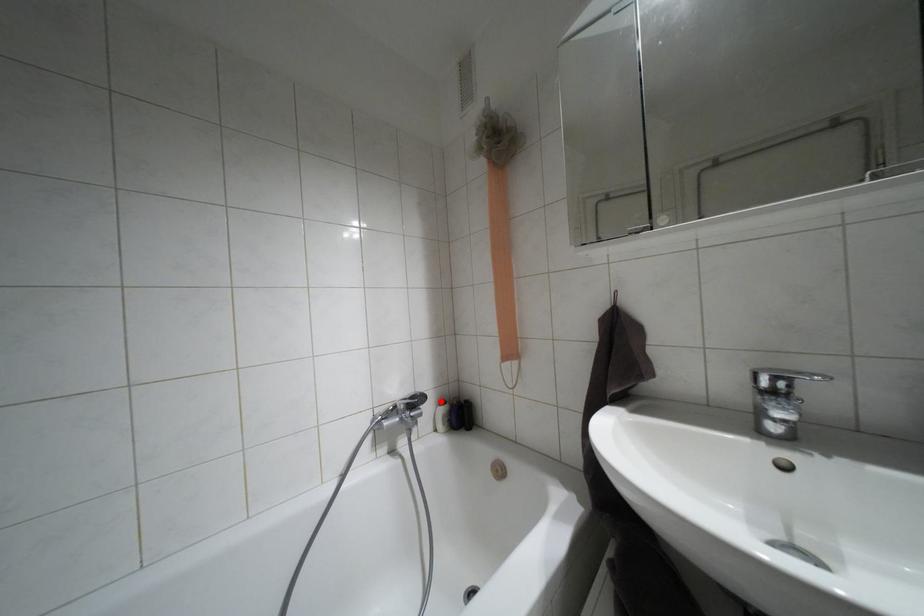
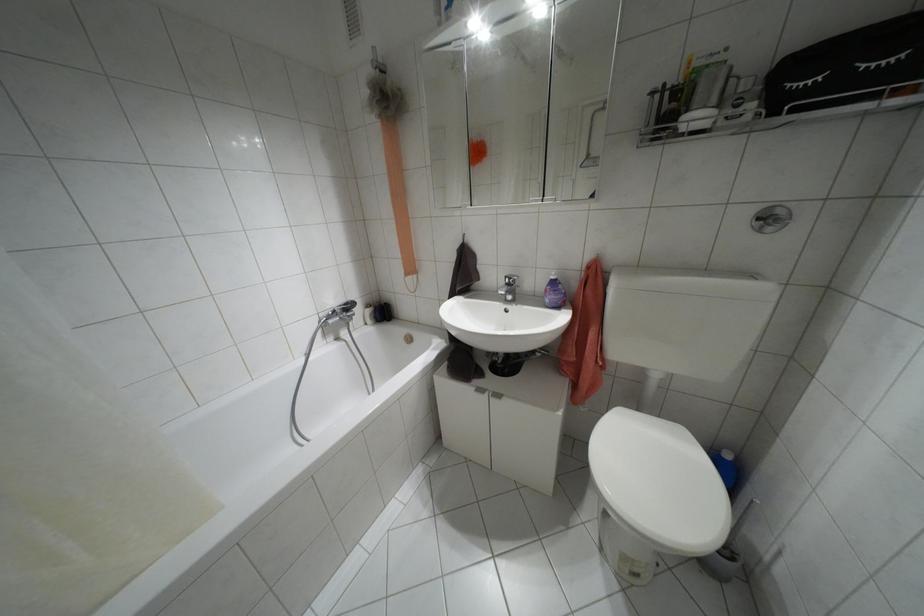
Find the pixel in the second image that matches the highlighted location in the first image.

(367, 305)